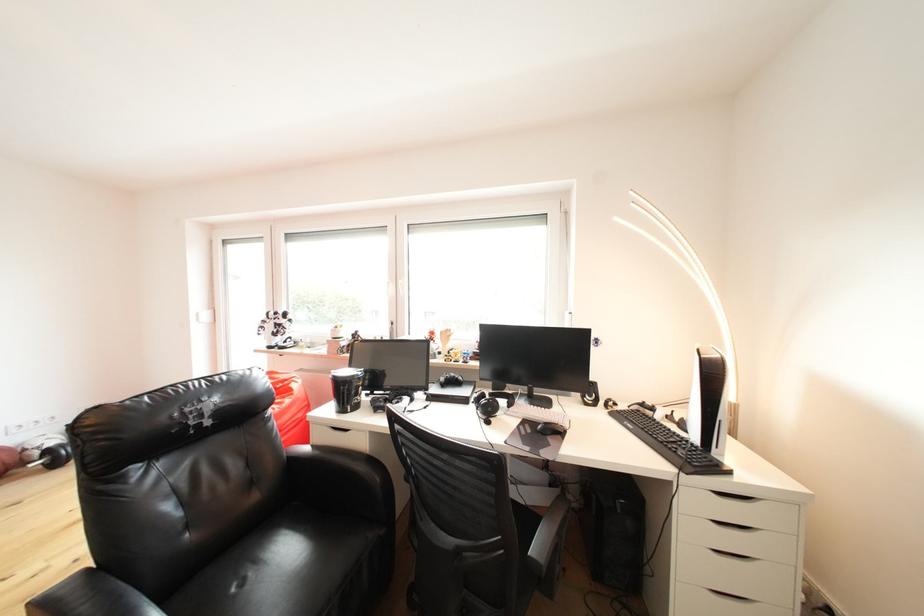
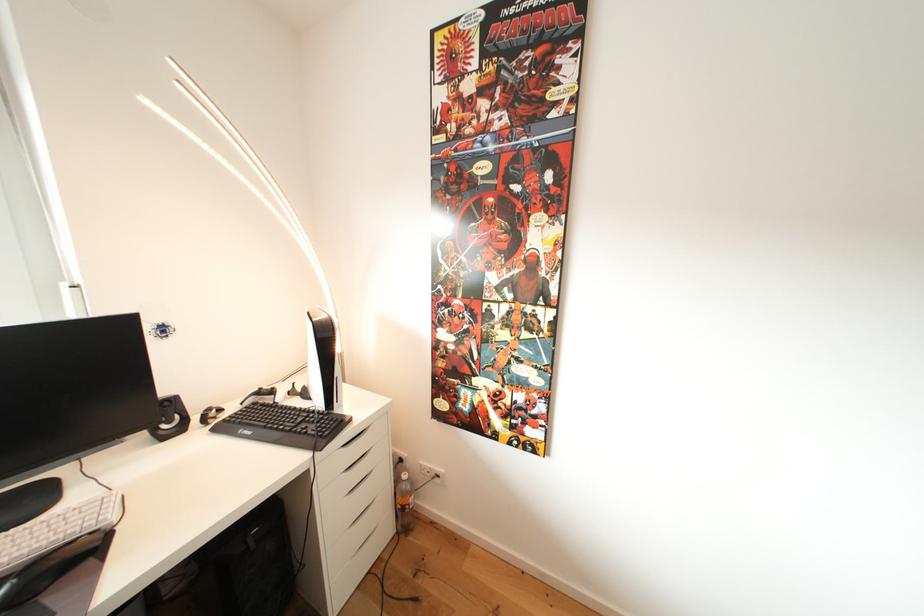
Where in the second image is the point corresponding to [624,410] from the first image?

(228, 415)